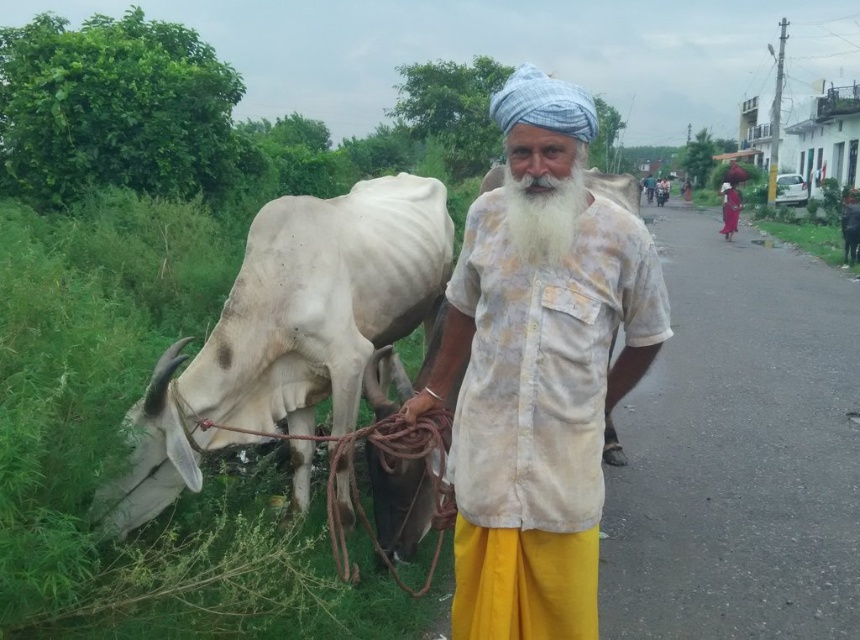
Does white matte cow at left appear on the right side of green leafy grass at lower right?

Incorrect, white matte cow at left is not on the right side of green leafy grass at lower right.

Does point (133, 502) lie in front of point (788, 221)?

That is True.

Which is in front, point (244, 346) or point (784, 237)?

Positioned in front is point (244, 346).

Where is `white matte cow at left`? This screenshot has width=860, height=640. white matte cow at left is located at coordinates (287, 332).

Between white matte cow at left and white fluffy beard at center, which one appears on the left side from the viewer's perspective?

white matte cow at left

Between white matte cow at left and white fluffy beard at center, which one is positioned higher?

white fluffy beard at center is above.

I want to click on white matte cow at left, so click(x=287, y=332).

The width and height of the screenshot is (860, 640). In order to click on white matte cow at left in this screenshot , I will do `click(287, 332)`.

Is point (470, 257) behind point (808, 234)?

No.

Is white cotton shirt at center further to the viewer compared to green leafy grass at lower right?

No, white cotton shirt at center is in front of green leafy grass at lower right.

Measure the distance between point [559,436] and camera.

A distance of 5.62 feet exists between point [559,436] and camera.

I want to click on white cotton shirt at center, so click(538, 369).